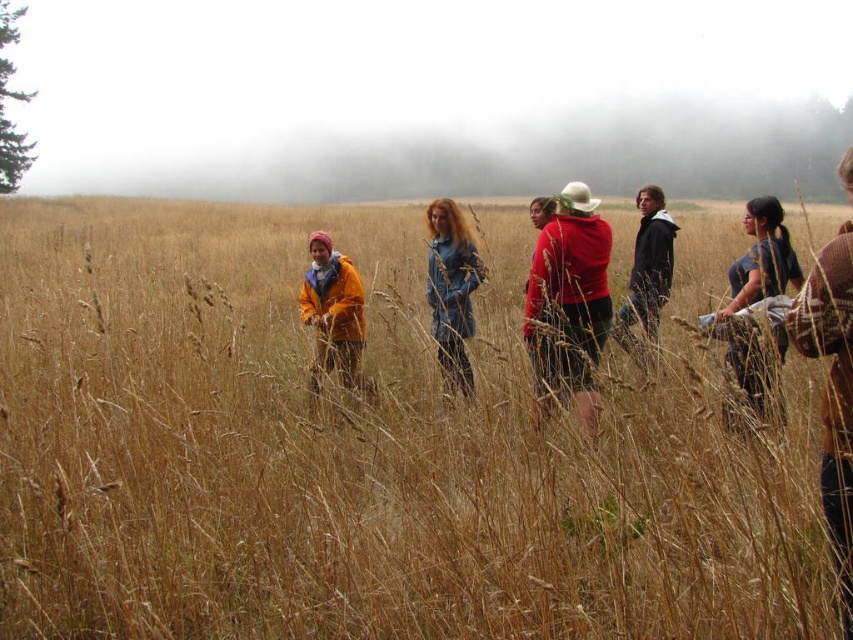
Does point (851, 445) come in front of point (657, 256)?

Yes.

Between point (848, 189) and point (633, 257), which one is positioned behind?

Positioned behind is point (633, 257).

What do you see at coordinates (833, 392) in the screenshot? I see `brown knitted hat at right` at bounding box center [833, 392].

Where is `brown knitted hat at right`? brown knitted hat at right is located at coordinates (833, 392).

Between brown dry grass at center and dark gray hoodie at center, which one is positioned higher?

brown dry grass at center is higher up.

Does brown dry grass at center appear on the right side of dark gray hoodie at center?

Incorrect, brown dry grass at center is not on the right side of dark gray hoodie at center.

What do you see at coordinates (360, 452) in the screenshot? The image size is (853, 640). I see `brown dry grass at center` at bounding box center [360, 452].

Locate an element on the screen. The image size is (853, 640). brown dry grass at center is located at coordinates (360, 452).

Which is behind, point (567, 307) or point (735, 292)?

The point (735, 292) is behind.

Which is more to the right, red matte hoodie at center or dark blue shirt at right?

Result: Positioned to the right is dark blue shirt at right.

Where is `red matte hoodie at center`? This screenshot has width=853, height=640. red matte hoodie at center is located at coordinates (569, 298).